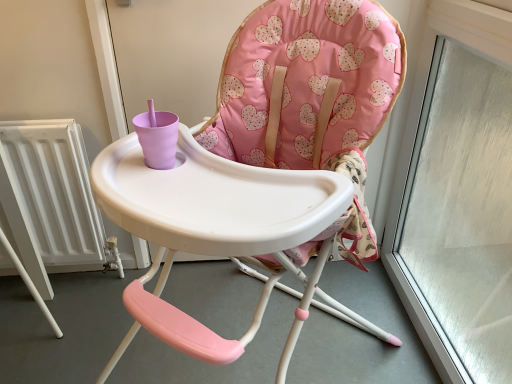
Find the location of a particular element. Image resolution: width=512 pixels, height=384 pixels. vacant region in front of white metallic radiator at left is located at coordinates (63, 321).